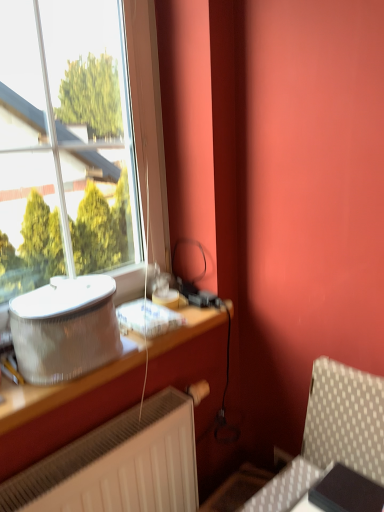
Question: Is silver metallic speaker at left situated inside metallic silver table at left or outside?

Choices:
 (A) inside
 (B) outside

Answer: (B)

Question: From the image's perspective, is silver metallic speaker at left positioned above or below metallic silver table at left?

Choices:
 (A) above
 (B) below

Answer: (A)

Question: In the image, is silver metallic speaker at left on the left side or the right side of metallic silver table at left?

Choices:
 (A) right
 (B) left

Answer: (B)

Question: Considering the positions of metallic silver table at left and silver metallic speaker at left in the image, is metallic silver table at left taller or shorter than silver metallic speaker at left?

Choices:
 (A) short
 (B) tall

Answer: (A)

Question: Is point (x=23, y=389) closer or farther from the camera than point (x=87, y=345)?

Choices:
 (A) closer
 (B) farther

Answer: (A)

Question: Relative to silver metallic speaker at left, is metallic silver table at left in front or behind?

Choices:
 (A) behind
 (B) front

Answer: (B)

Question: Is metallic silver table at left to the left or to the right of silver metallic speaker at left in the image?

Choices:
 (A) left
 (B) right

Answer: (B)